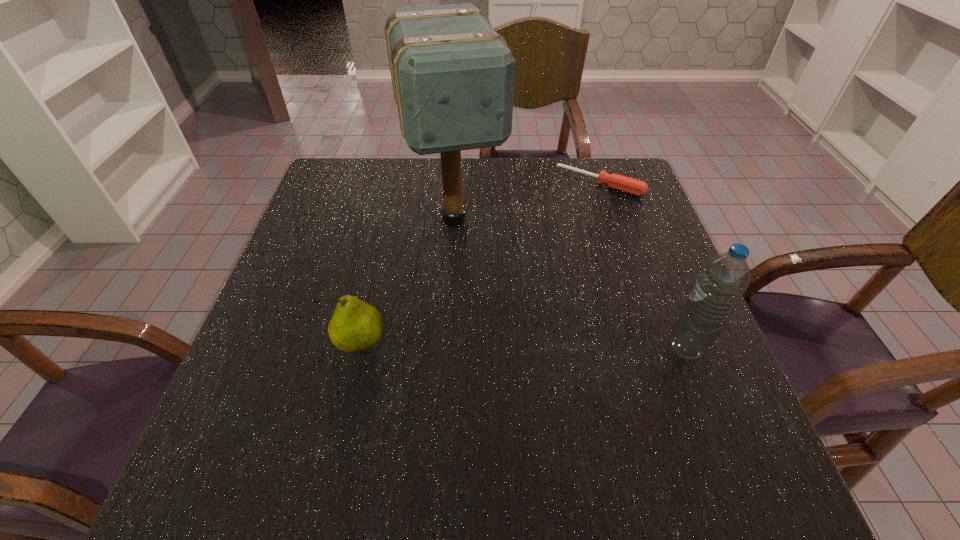
Identify the location of free location located 0.330m at the blade of the shortest object. The height and width of the screenshot is (540, 960). (530, 270).

This screenshot has width=960, height=540. Find the location of `blank space located 0.270m at the blade of the shortest object`. blank space located 0.270m at the blade of the shortest object is located at coordinates (541, 255).

This screenshot has height=540, width=960. What are the coordinates of `mallet that is at the far edge` in the screenshot? It's located at (452, 75).

At what (x,y) coordinates should I click in order to perform the action: click on screwdriver that is at the far edge. Please return your answer as a coordinate pair (x, y). Looking at the image, I should click on (632, 186).

Find the location of `water bottle present at the right edge`. water bottle present at the right edge is located at coordinates (723, 280).

You are a GUI agent. You are given a task and a screenshot of the screen. Output one action in this format:
    pyautogui.click(x=<x>, y=<y>)
    Task: Click on the screwdriver that is at the right edge
    
    Given the screenshot: What is the action you would take?
    pyautogui.click(x=632, y=186)

Locate an element on the screen. object that is at the far right corner is located at coordinates (632, 186).

Locate an element on the screen. This screenshot has width=960, height=540. free spot at the far edge of the desktop is located at coordinates [x=393, y=181].

Where is `free space at the near edge of the desktop`? This screenshot has height=540, width=960. free space at the near edge of the desktop is located at coordinates (538, 401).

Image resolution: width=960 pixels, height=540 pixels. In the image, there is a desktop. In order to click on vacant space at the left edge in this screenshot , I will do `click(286, 370)`.